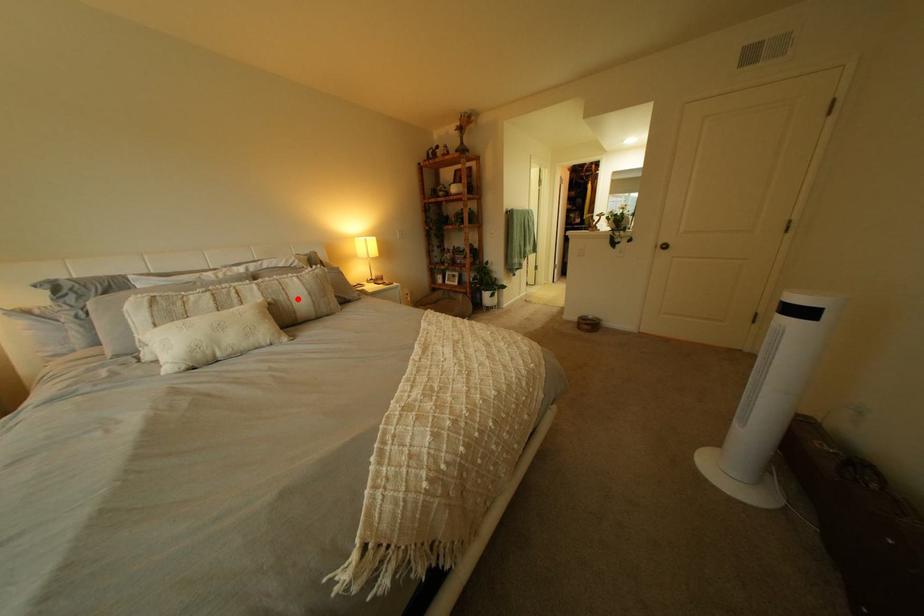
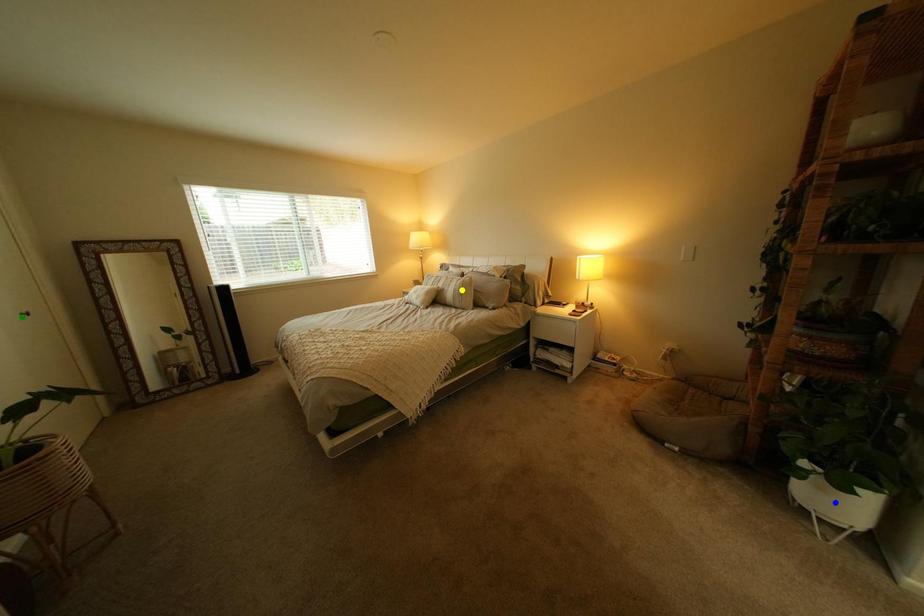
Question: I am providing you with two images of the same scene from different viewpoints. A red point is marked on the first image. You are given multiple points on the second image. Which spot in image 2 lines up with the point in image 1?

Choices:
 (A) green point
 (B) blue point
 (C) yellow point

Answer: (C)